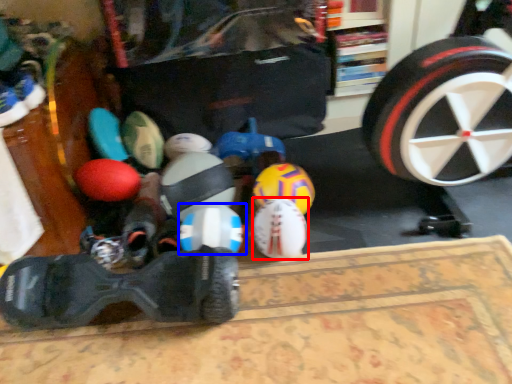
Question: Which point is closer to the camera, toy (highlighted by a red box) or toy (highlighted by a blue box)?

Choices:
 (A) toy
 (B) toy

Answer: (B)